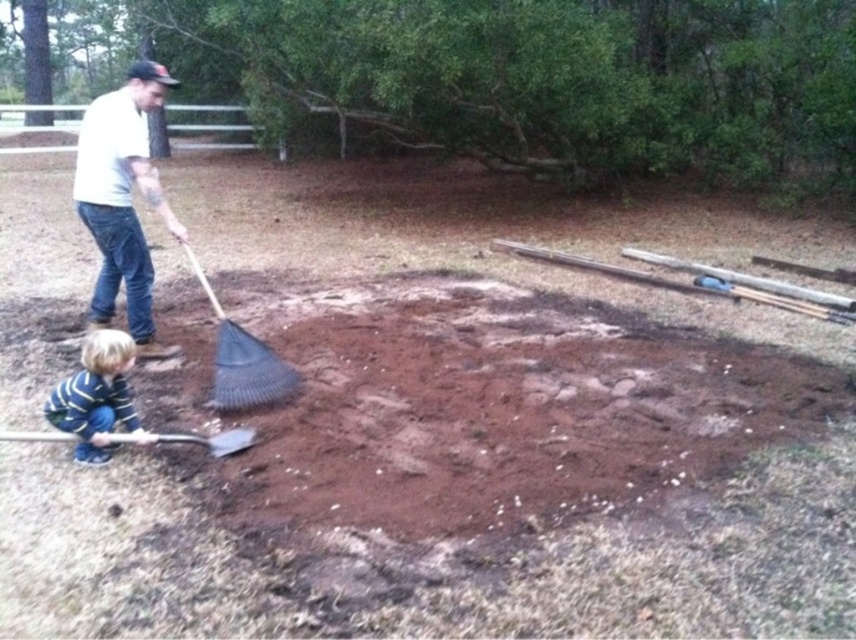
Is the position of white matte shirt at upper left more distant than that of striped cotton shirt at lower left?

Yes, it is behind striped cotton shirt at lower left.

The height and width of the screenshot is (640, 856). Find the location of `white matte shirt at upper left`. white matte shirt at upper left is located at coordinates (122, 198).

At what (x,y) coordinates should I click in order to perform the action: click on white matte shirt at upper left. Please return your answer as a coordinate pair (x, y). Looking at the image, I should click on (122, 198).

Find the location of `white matte shirt at upper left`. white matte shirt at upper left is located at coordinates (122, 198).

Between white matte shirt at upper left and black plastic rake at center, which one is positioned lower?

black plastic rake at center

Does white matte shirt at upper left have a greater width compared to black plastic rake at center?

Indeed, white matte shirt at upper left has a greater width compared to black plastic rake at center.

Does point (80, 179) lie in front of point (244, 401)?

No, it is behind (244, 401).

The height and width of the screenshot is (640, 856). Find the location of `white matte shirt at upper left`. white matte shirt at upper left is located at coordinates (122, 198).

Is striped cotton shirt at lower left positioned behind wooden shovel at lower left?

Yes, it is.

The height and width of the screenshot is (640, 856). What are the coordinates of `striped cotton shirt at lower left` in the screenshot? It's located at (94, 396).

Measure the distance between point (68, 397) and camera.

Point (68, 397) and camera are 3.13 meters apart from each other.

Locate an element on the screen. The image size is (856, 640). striped cotton shirt at lower left is located at coordinates (94, 396).